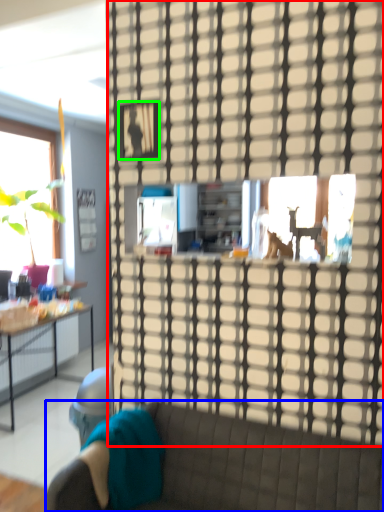
Question: Based on their relative distances, which object is nearer to glass door (highlighted by a red box)? Choose from studio couch (highlighted by a blue box) and picture frame (highlighted by a green box).

Choices:
 (A) studio couch
 (B) picture frame

Answer: (B)